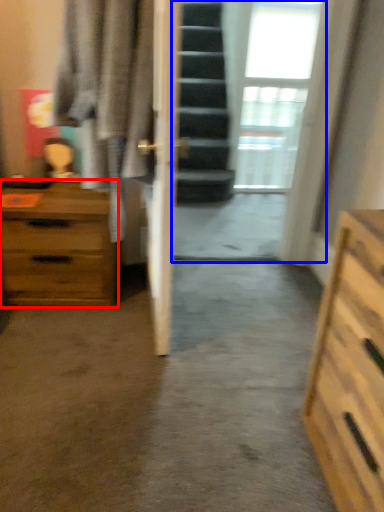
Question: Among these objects, which one is farthest to the camera, chest of drawers (highlighted by a red box) or glass door (highlighted by a blue box)?

Choices:
 (A) chest of drawers
 (B) glass door

Answer: (B)